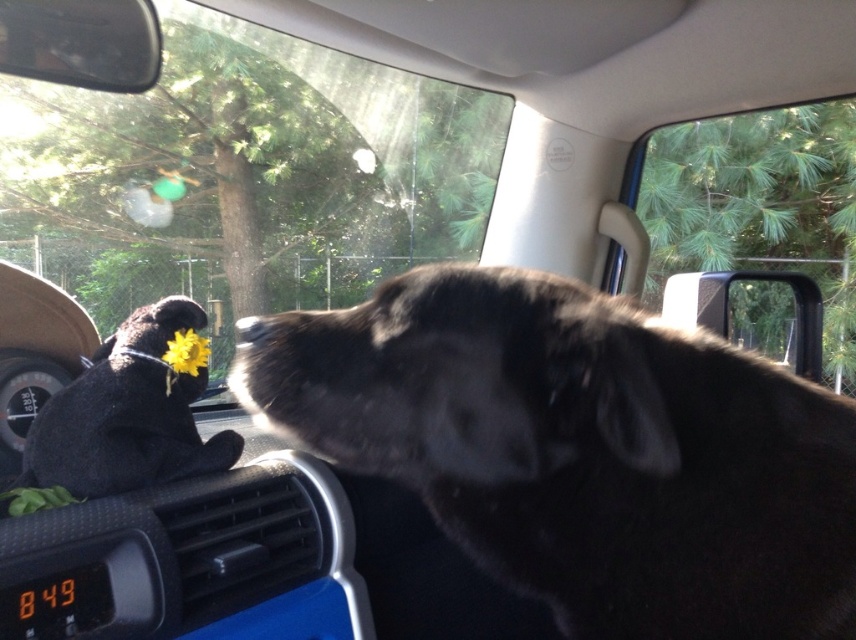
Does black fur dog at center appear over yellow fabric flower at center?

No, black fur dog at center is not above yellow fabric flower at center.

Is black fur dog at center taller than yellow fabric flower at center?

Yes, black fur dog at center is taller than yellow fabric flower at center.

You are a GUI agent. You are given a task and a screenshot of the screen. Output one action in this format:
    pyautogui.click(x=<x>, y=<y>)
    Task: Click on the black fur dog at center
    The image size is (856, 640).
    Given the screenshot: What is the action you would take?
    pyautogui.click(x=580, y=449)

Between black fur dog at center and clear glass window at upper right, which one is positioned lower?

Positioned lower is black fur dog at center.

The image size is (856, 640). What do you see at coordinates (580, 449) in the screenshot?
I see `black fur dog at center` at bounding box center [580, 449].

Between point (352, 426) and point (663, 129), which one is positioned behind?

Point (663, 129)

Locate an element on the screen. This screenshot has height=640, width=856. black fur dog at center is located at coordinates (580, 449).

In the scene shown: Between clear glass window at upper right and yellow fabric flower at center, which one has less height?

yellow fabric flower at center is shorter.

This screenshot has height=640, width=856. I want to click on clear glass window at upper right, so click(758, 218).

Is point (730, 180) positioned after point (163, 356)?

Yes, it is behind point (163, 356).

Where is `clear glass window at upper right`? clear glass window at upper right is located at coordinates (758, 218).